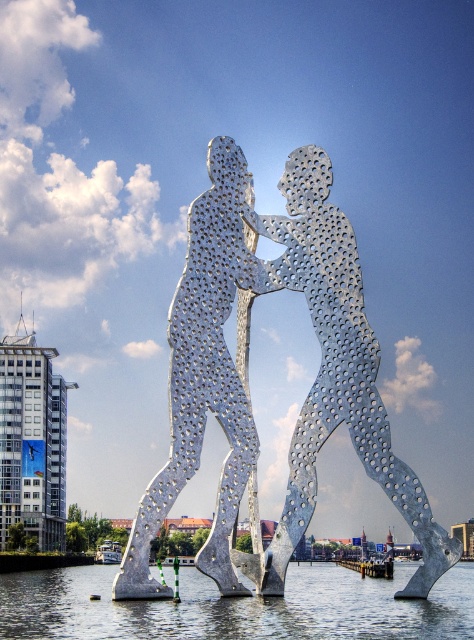
You are an art student analyzing the sculpture. You observe the metallic perforated human figure at center and the metallic silver sculpture at center. Which one has a greater height?

The metallic perforated human figure at center is taller than the metallic silver sculpture at center.

What is the location of the point with coordinates (336, 376) in the sculpture?

The point with coordinates (336, 376) is located on the metallic perforated human figure at center.